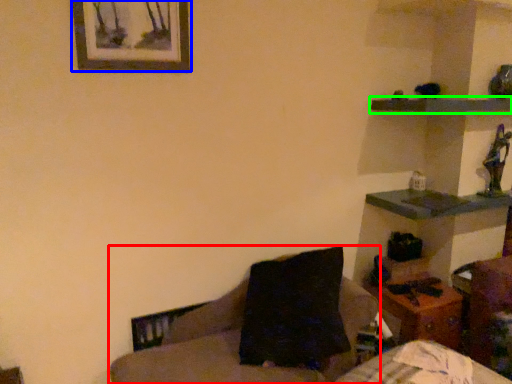
Question: Which object is the closest to the furniture (highlighted by a red box)? Choose among these: picture frame (highlighted by a blue box) or shelf (highlighted by a green box).

Choices:
 (A) picture frame
 (B) shelf

Answer: (A)